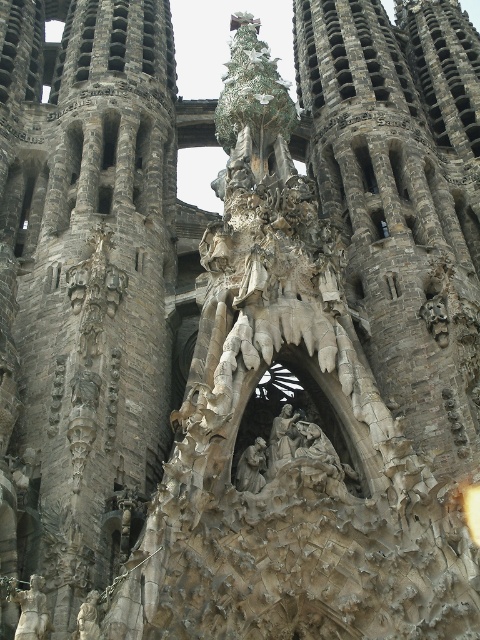
Question: Can you confirm if white stone statue at lower left is bigger than gray stone statue at center?

Choices:
 (A) no
 (B) yes

Answer: (A)

Question: Is gray stone statue at center above matte stone statue at center?

Choices:
 (A) yes
 (B) no

Answer: (A)

Question: Which point is farther from the camera taking this photo?

Choices:
 (A) (39, 618)
 (B) (257, 460)
 (C) (94, 637)

Answer: (B)

Question: Which object is closer to the camera taking this photo?

Choices:
 (A) gray stone statue at center
 (B) white stone statue at lower left

Answer: (B)

Question: Can you confirm if green textured tree at center is positioned to the right of white stone statue at lower left?

Choices:
 (A) no
 (B) yes

Answer: (B)

Question: Which of the following is the closest to the observer?

Choices:
 (A) (38, 586)
 (B) (264, 449)
 (C) (96, 598)

Answer: (A)